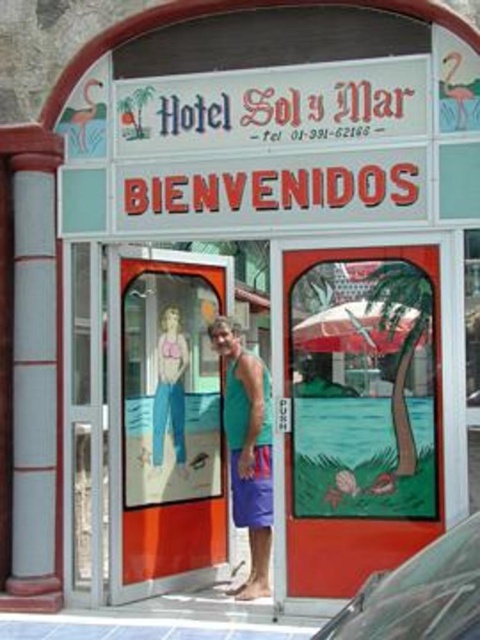
Question: Based on their relative distances, which object is farther from the pink fabric at center?

Choices:
 (A) red matte umbrella at center
 (B) transparent plastic car at lower right

Answer: (B)

Question: Which point is farther from the camera taking this photo?

Choices:
 (A) (260, 502)
 (B) (374, 349)
 (C) (375, 630)
 (D) (165, 348)

Answer: (D)

Question: Is teal fabric tank top at center further to the viewer compared to red matte umbrella at center?

Choices:
 (A) yes
 (B) no

Answer: (A)

Question: Can you confirm if teal fabric tank top at center is wider than pink fabric at center?

Choices:
 (A) no
 (B) yes

Answer: (B)

Question: Which of the following is the farthest from the observer?

Choices:
 (A) transparent plastic car at lower right
 (B) red matte umbrella at center
 (C) teal fabric tank top at center
 (D) pink fabric at center

Answer: (D)

Question: Does red matte umbrella at center have a lesser width compared to pink fabric at center?

Choices:
 (A) yes
 (B) no

Answer: (B)